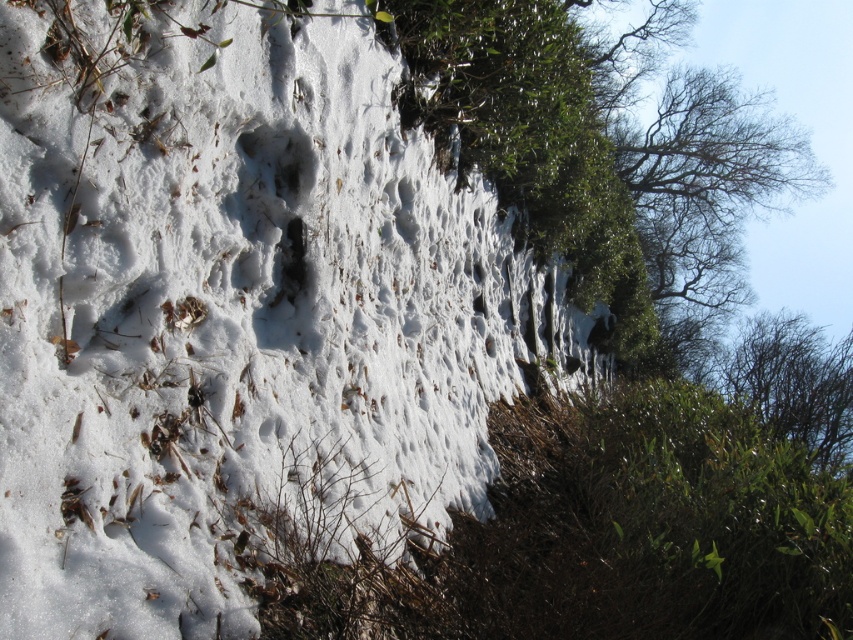
Can you confirm if white fluffy snow at center is thinner than green leafy tree at upper right?

Correct, white fluffy snow at center's width is less than green leafy tree at upper right's.

Looking at this image, who is more distant from viewer, [254,476] or [808,326]?

Point [808,326]

You are a GUI agent. You are given a task and a screenshot of the screen. Output one action in this format:
    pyautogui.click(x=<x>, y=<y>)
    Task: Click on the white fluffy snow at center
    
    Given the screenshot: What is the action you would take?
    (x=235, y=308)